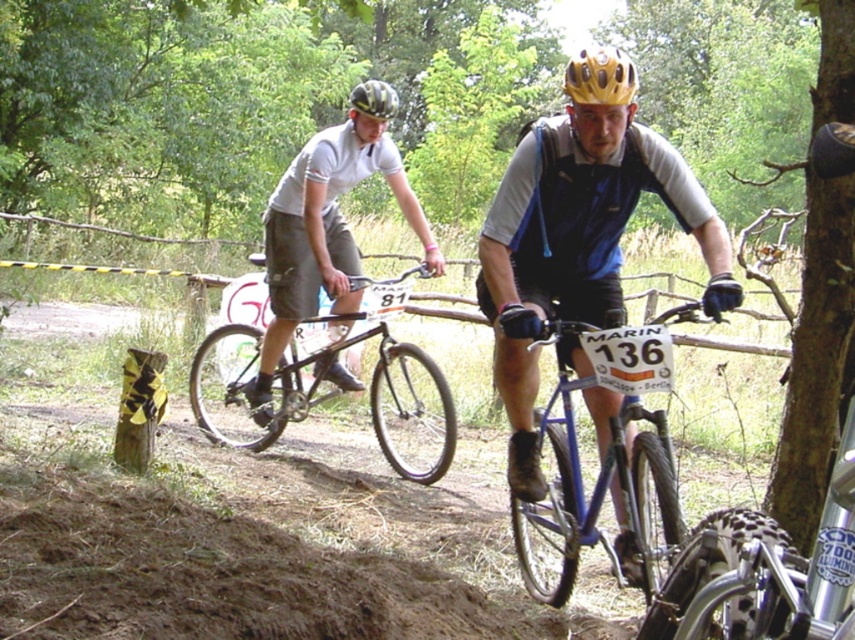
You are a photographer positioned at the center of the dirt path. You want to capture both cyclists in a single shot. The first cyclist is at point (635, 525) and the second is at point (394, 113). Which cyclist should you adjust your camera to focus on first to ensure both are in frame?

You should focus on the cyclist at point (394, 113) first because point (635, 525) is in front of point (394, 113), meaning the first cyclist is closer to the camera. By focusing on the farther cyclist first, you can adjust the frame to include both.

You are a photographer trying to capture both the blue metallic bicycle at center and the matte black helmet at upper center in a single shot. Which object should you adjust your camera to focus on first if you want to ensure the thinner object is in sharp focus?

The blue metallic bicycle at center is thinner than the matte black helmet at upper center. To ensure the thinner object is in sharp focus, you should focus on the blue metallic bicycle at center first.

You are standing at the point marked as point [565,576] and want to take a photo of the two cyclists. The camera you are using has a maximum focus range of 13 feet. Will the camera be able to focus on the cyclists?

The point [565,576] and viewer are 13.51 feet apart from each other. Since the camera has a maximum focus range of 13 feet, the camera will not be able to focus on the cyclists because the distance is slightly beyond the camera limit.